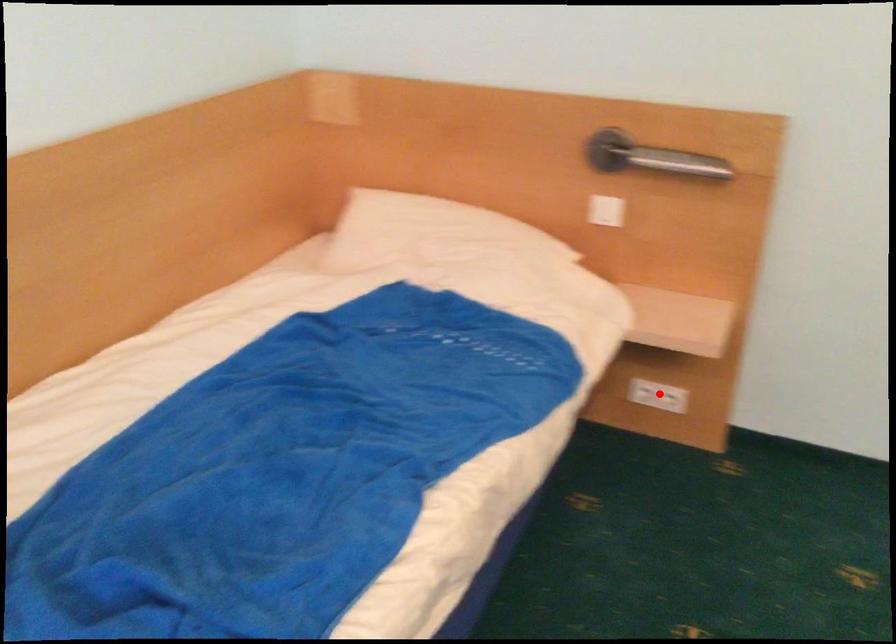
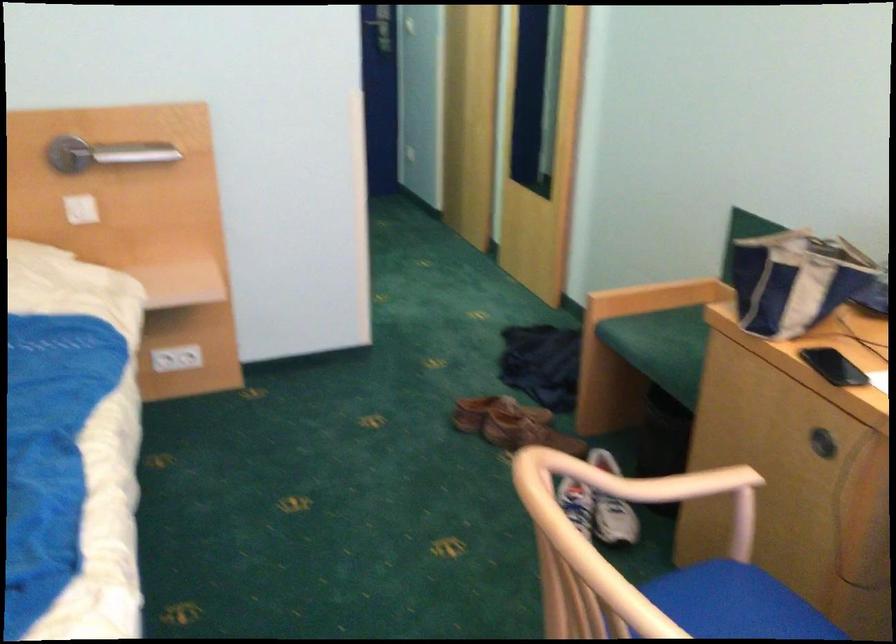
Question: I am providing you with two images of the same scene from different viewpoints. A red point is marked on the first image. Can you still see the location of the red point in image 2?

Choices:
 (A) Yes
 (B) No

Answer: (A)